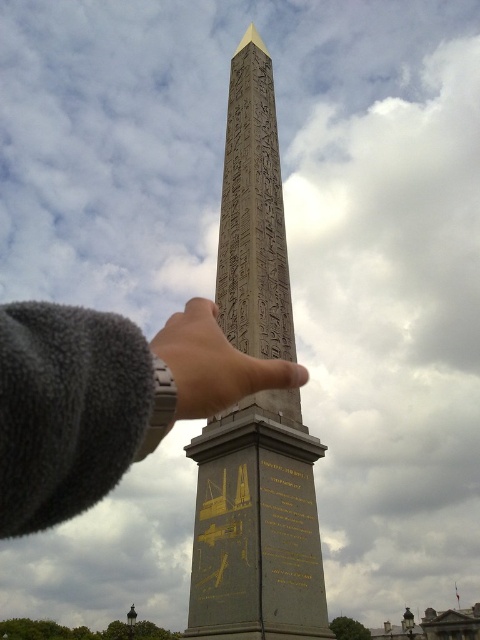
You are standing in front of the obelisk and want to touch it with your finger. Based on the image, will your gray fleece finger at center reach the top of the gray polished stone obelisk at center?

The gray polished stone obelisk at center is taller than the gray fleece finger at center, so the gray fleece finger at center cannot reach the top of the gray polished stone obelisk at center.

You are standing in front of the obelisk and notice your hand pointing towards it. Which object is closer to you between the gray polished stone obelisk at center and the gray fleece finger at center?

The gray fleece finger at center is closer to you since the gray polished stone obelisk at center is further away from the viewer.